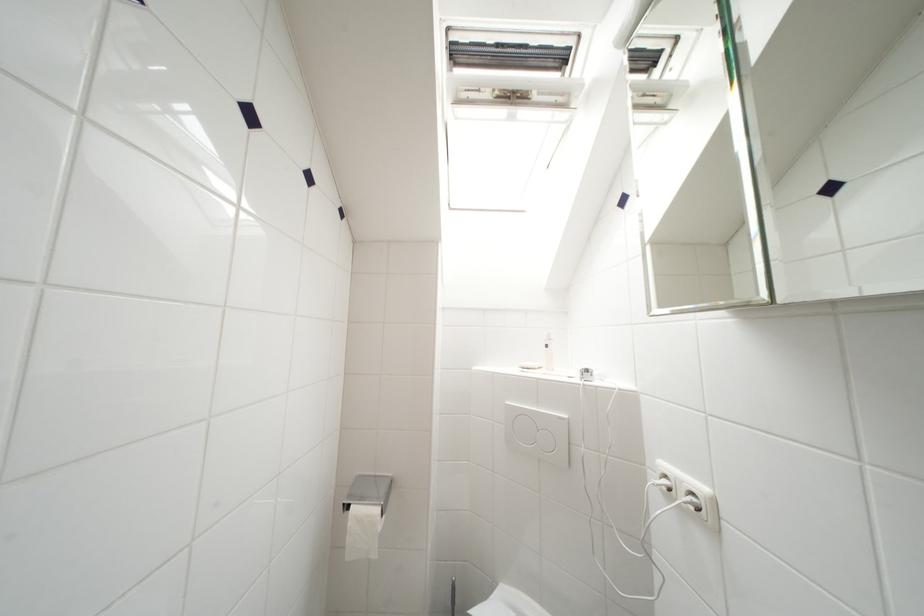
Where would you push the large flush button? Please return your answer as a coordinate pair (x, y).

(537, 432)